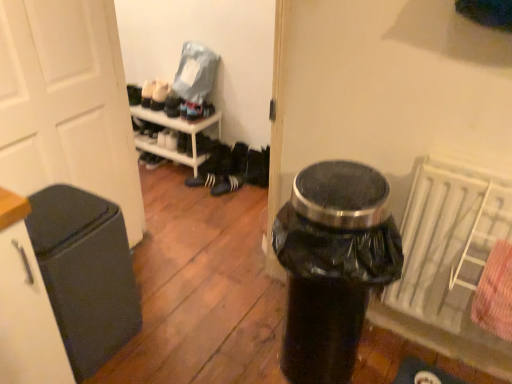
In order to click on black matte trash can at left in this screenshot , I will do `click(85, 273)`.

Looking at this image, what is the approximate width of white matte door at left?

It is 5.09 inches.

Locate an element on the screen. white matte door at left is located at coordinates (67, 103).

Identify the location of shiny black shoe at center. (172, 105).

What do you see at coordinates (180, 126) in the screenshot? I see `white plastic shoe rack at upper center` at bounding box center [180, 126].

Identify the location of black matte sneakers at center, the second footwear from the right. (202, 180).

Image resolution: width=512 pixels, height=384 pixels. What do you see at coordinates (227, 185) in the screenshot?
I see `black suede sneakers at center, the first footwear from the right` at bounding box center [227, 185].

This screenshot has width=512, height=384. Describe the element at coordinates (449, 243) in the screenshot. I see `white textured radiator at right` at that location.

Where is `black matte trash can at left`? black matte trash can at left is located at coordinates (85, 273).

Is white matte cabinet at left oriented towards white matte door at left?

No, white matte cabinet at left is not aimed at white matte door at left.

Is white matte cabinet at left to the left or to the right of white matte door at left in the image?

Based on their positions, white matte cabinet at left is located to the left of white matte door at left.

From the image's perspective, is white matte cabinet at left on white matte door at left?

No, from the image's perspective, white matte cabinet at left is not on top of white matte door at left.

Consider the image. From the image's perspective, which one is positioned lower, black matte trash can at left or shiny black shoe at center?

black matte trash can at left, from the image's perspective.

This screenshot has height=384, width=512. Find the location of `shoe above the black matte trash can at left (from a real-world perspective)`. shoe above the black matte trash can at left (from a real-world perspective) is located at coordinates (172, 105).

Is black matte trash can at left at the right side of shiny black shoe at center?

In fact, black matte trash can at left is to the left of shiny black shoe at center.

Which object is further away from the camera taking this photo, black matte trash can at left or shiny black shoe at center?

Positioned behind is shiny black shoe at center.

Is white plastic shoe rack at upper center completely or partially inside black suede sneakers at center, placed as the 2th footwear when sorted from left to right?

Definitely not — white plastic shoe rack at upper center is not inside black suede sneakers at center, placed as the 2th footwear when sorted from left to right.

Does black suede sneakers at center, placed as the 2th footwear when sorted from left to right, lie in front of white plastic shoe rack at upper center?

No, it is not.

From the image's perspective, which is above, black suede sneakers at center, the first footwear from the right, or white plastic shoe rack at upper center?

From the image's view, white plastic shoe rack at upper center is above.

In terms of size, does black suede sneakers at center, the first footwear from the right, appear bigger or smaller than white plastic shoe rack at upper center?

In the image, black suede sneakers at center, the first footwear from the right, appears to be smaller than white plastic shoe rack at upper center.

Is point (75, 201) positioned before point (17, 143)?

Yes.

Is black matte trash can at left facing away from white matte door at left?

Correct, black matte trash can at left is looking away from white matte door at left.

Is black matte trash can at left inside the boundaries of white matte door at left, or outside?

black matte trash can at left exists outside the volume of white matte door at left.

Does black matte trash can at left have a larger size compared to white matte door at left?

No.

From the picture: Between white textured radiator at right and black suede sneakers at center, the first footwear from the right, which one is positioned behind?

black suede sneakers at center, the first footwear from the right, is further from the camera.

This screenshot has width=512, height=384. Find the location of `the 1st footwear counting from the left of the white textured radiator at right`. the 1st footwear counting from the left of the white textured radiator at right is located at coordinates (227, 185).

From a real-world perspective, which is physically above, white textured radiator at right or black suede sneakers at center, placed as the 2th footwear when sorted from left to right?

white textured radiator at right is physically above.

Are white textured radiator at right and black suede sneakers at center, placed as the 2th footwear when sorted from left to right, beside each other?

No, white textured radiator at right is not in contact with black suede sneakers at center, placed as the 2th footwear when sorted from left to right.

Considering the relative sizes of shiny black shoe at center and black matte sneakers at center, the first footwear viewed from the left, in the image provided, is shiny black shoe at center smaller than black matte sneakers at center, the first footwear viewed from the left,?

Correct, shiny black shoe at center occupies less space than black matte sneakers at center, the first footwear viewed from the left.

Does shiny black shoe at center have a greater width compared to black matte sneakers at center, the first footwear viewed from the left?

Correct, the width of shiny black shoe at center exceeds that of black matte sneakers at center, the first footwear viewed from the left.

From their relative heights in the image, would you say shiny black shoe at center is taller or shorter than black matte sneakers at center, the first footwear viewed from the left?

Considering their sizes, shiny black shoe at center has more height than black matte sneakers at center, the first footwear viewed from the left.

Could you measure the distance between shiny black shoe at center and black matte sneakers at center, the second footwear from the right?

shiny black shoe at center and black matte sneakers at center, the second footwear from the right, are 18.68 inches apart.

From a real-world perspective, is black matte sneakers at center, the second footwear from the right, positioned above or below black plastic trash can at center?

black matte sneakers at center, the second footwear from the right, is below black plastic trash can at center.

What's the angular difference between black matte sneakers at center, the second footwear from the right, and black plastic trash can at center's facing directions?

31.9 degrees.

Which is in front, point (210, 177) or point (397, 275)?

The point (397, 275) is more forward.

From the image's perspective, relative to black plastic trash can at center, is black matte sneakers at center, the second footwear from the right, above or below?

Based on their image positions, black matte sneakers at center, the second footwear from the right, is located above black plastic trash can at center.

Find the location of a particular element. door above the white matte cabinet at left (from a real-world perspective) is located at coordinates (67, 103).

Where is `garbage below the shiny black shoe at center (from the image's perspective)`? garbage below the shiny black shoe at center (from the image's perspective) is located at coordinates (85, 273).

Considering their positions, is black matte sneakers at center, the second footwear from the right, positioned closer to white matte door at left than black suede sneakers at center, the first footwear from the right?

black matte sneakers at center, the second footwear from the right, is positioned closer to the anchor white matte door at left.

Looking at this image, based on their spatial positions, is white textured radiator at right or white plastic shoe rack at upper center further from white matte cabinet at left?

white plastic shoe rack at upper center is positioned further to the anchor white matte cabinet at left.

From the image, which object appears to be farther from black suede sneakers at center, placed as the 2th footwear when sorted from left to right, white plastic shoe rack at upper center or white matte door at left?

white matte door at left is further to black suede sneakers at center, placed as the 2th footwear when sorted from left to right.

When comparing their distances from black suede sneakers at center, placed as the 2th footwear when sorted from left to right, does white matte cabinet at left or white plastic shoe rack at upper center seem closer?

white plastic shoe rack at upper center.

From the image, which object appears to be nearer to black matte trash can at left, shiny black shoe at center or white matte door at left?

Based on the image, white matte door at left appears to be nearer to black matte trash can at left.

Based on their spatial positions, is white plastic shoe rack at upper center or white matte door at left closer to black matte sneakers at center, the second footwear from the right?

white plastic shoe rack at upper center.

Considering their positions, is black plastic trash can at center positioned closer to shiny black shoe at center than white textured radiator at right?

The object closer to shiny black shoe at center is black plastic trash can at center.

In the scene shown: Based on their spatial positions, is white textured radiator at right or black suede sneakers at center, placed as the 2th footwear when sorted from left to right, further from black plastic trash can at center?

black suede sneakers at center, placed as the 2th footwear when sorted from left to right, is further to black plastic trash can at center.

Find the location of a particular element. The image size is (512, 384). shoe between white matte cabinet at left and black matte sneakers at center, the first footwear viewed from the left, in the front-back direction is located at coordinates (172, 105).

This screenshot has height=384, width=512. I want to click on radiator positioned between black plastic trash can at center and black suede sneakers at center, placed as the 2th footwear when sorted from left to right, from near to far, so click(449, 243).

The image size is (512, 384). In order to click on garbage positioned between white textured radiator at right and white plastic shoe rack at upper center from near to far in this screenshot , I will do `click(85, 273)`.

Find the location of `footwear located between black matte trash can at left and black matte sneakers at center, the second footwear from the right, in the depth direction`. footwear located between black matte trash can at left and black matte sneakers at center, the second footwear from the right, in the depth direction is located at coordinates (227, 185).